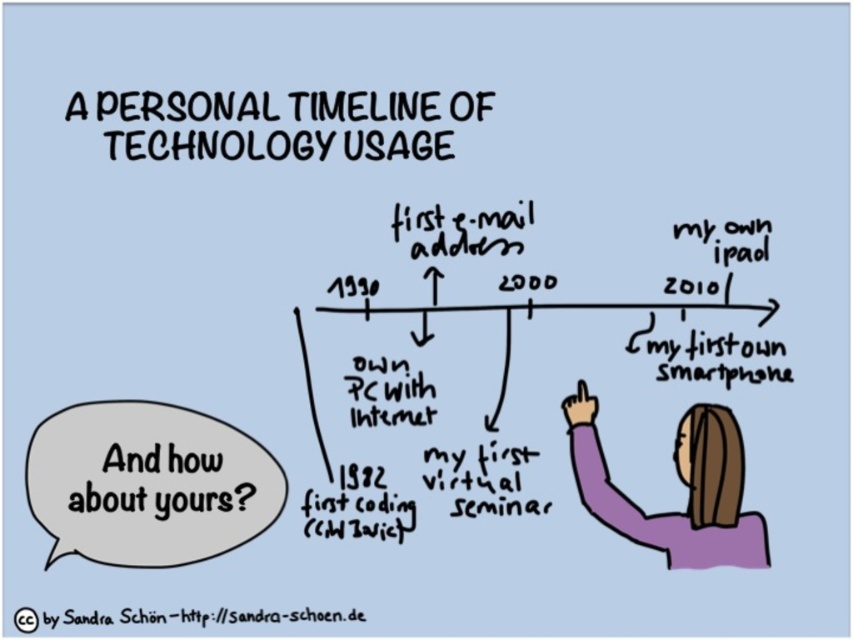
Is black paper speech bubble at lower left taller than bluetextcc symbol at upper left?

Yes.

Is the position of black paper speech bubble at lower left more distant than that of bluetextcc symbol at upper left?

Yes, it is.

Find the location of a particular element. black paper speech bubble at lower left is located at coordinates (161, 460).

The height and width of the screenshot is (640, 853). Identify the location of black paper speech bubble at lower left. (161, 460).

Which is in front, point (405, 132) or point (364, 515)?

Point (405, 132) is in front.

Does point (381, 108) lie behind point (318, 506)?

That is False.

I want to click on black paper at upper center, so click(x=276, y=122).

Is gray paper speech bubble at lower left below black paper speech bubble at lower left?

Yes.

What do you see at coordinates (148, 484) in the screenshot?
I see `gray paper speech bubble at lower left` at bounding box center [148, 484].

Does point (225, 499) come in front of point (219, 497)?

No, (225, 499) is behind (219, 497).

The width and height of the screenshot is (853, 640). What are the coordinates of `gray paper speech bubble at lower left` in the screenshot? It's located at (148, 484).